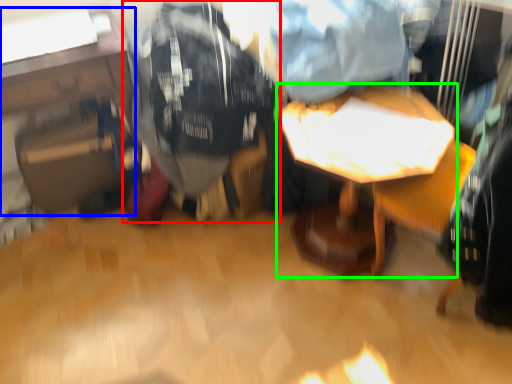
Question: Based on their relative distances, which object is farther from clothing (highlighted by a red box)? Choose from table (highlighted by a blue box) and table (highlighted by a green box).

Choices:
 (A) table
 (B) table

Answer: (B)